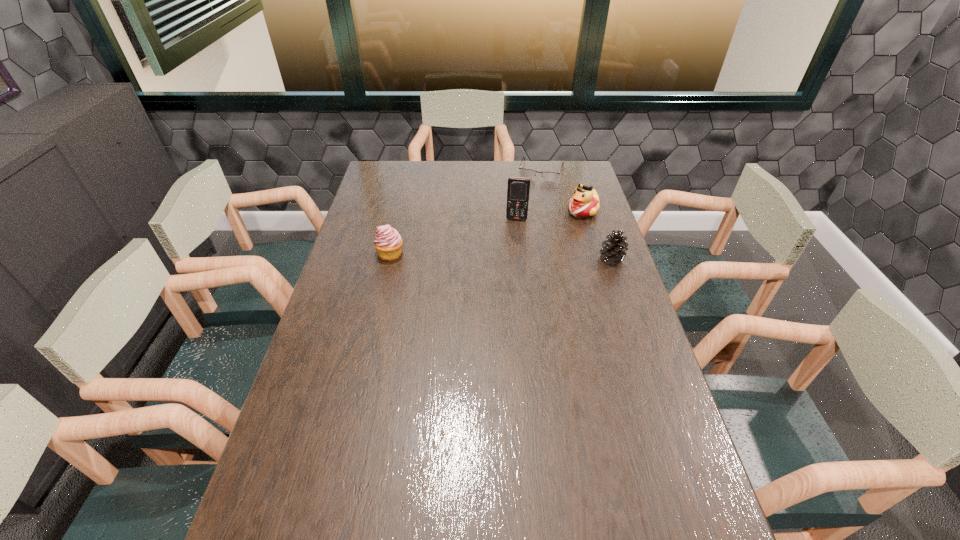
Image resolution: width=960 pixels, height=540 pixels. Identify the location of the leftmost object. (x=388, y=243).

Find the location of a particular element. The height and width of the screenshot is (540, 960). pinecone is located at coordinates (614, 247).

Locate an element on the screen. This screenshot has height=540, width=960. duck is located at coordinates (585, 202).

Identify the location of the shortest object. (526, 173).

The width and height of the screenshot is (960, 540). Find the location of `spectacles`. spectacles is located at coordinates (526, 173).

I want to click on the tallest object, so click(518, 189).

Find the location of a particular element. Image resolution: width=960 pixels, height=540 pixels. free space located 0.110m on the back of the cupcake is located at coordinates [x=396, y=226].

Locate an element on the screen. The height and width of the screenshot is (540, 960). vacant area located on the left of the pinecone is located at coordinates (581, 259).

Where is `vacant space located on the face of the duck`? vacant space located on the face of the duck is located at coordinates (510, 262).

Find the location of a particular element. blank area located on the face of the duck is located at coordinates (506, 265).